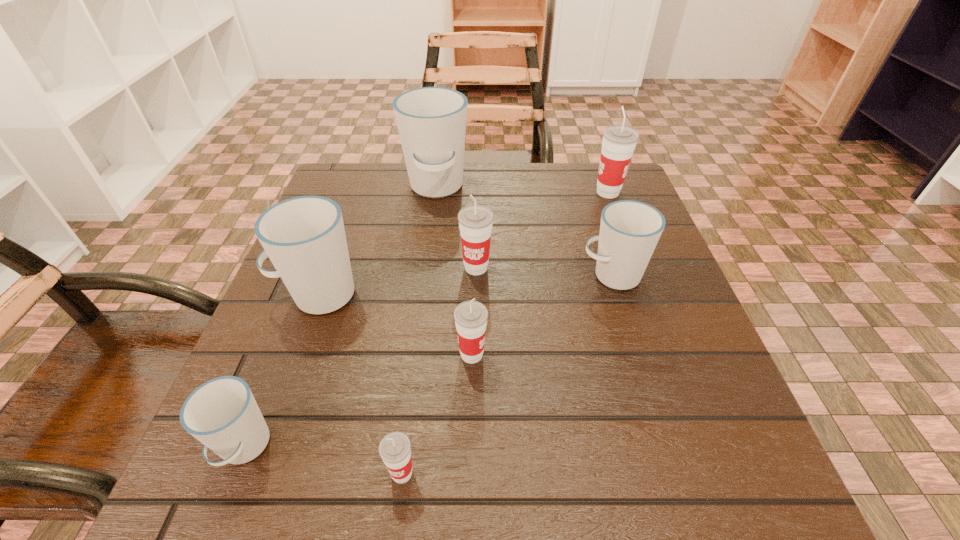
This screenshot has width=960, height=540. I want to click on white cup that is the second closest to the nearest red cup, so click(x=304, y=237).

The width and height of the screenshot is (960, 540). Identify the location of white cup that stands as the third closest to the third nearest red cup. (304, 237).

Identify the location of red cup that is the second closest to the rightmost white cup. [x=619, y=141].

Where is `red cup that is the closest to the second biggest red cup`? This screenshot has width=960, height=540. red cup that is the closest to the second biggest red cup is located at coordinates (471, 316).

Image resolution: width=960 pixels, height=540 pixels. I want to click on blank space that satisfies the following two spatial constraints: 1. on the side of the second biggest red cup with the logo; 2. with a handle on the side of the second biggest white cup, so click(476, 295).

Where is `vacant region that satisfies the following two spatial constraints: 1. with a handle on the side of the rightmost white cup; 2. with a handle on the side of the smallest white cup`? vacant region that satisfies the following two spatial constraints: 1. with a handle on the side of the rightmost white cup; 2. with a handle on the side of the smallest white cup is located at coordinates (665, 448).

I want to click on vacant area in the image that satisfies the following two spatial constraints: 1. on the side of the rightmost red cup with the logo; 2. on the side of the third nearest red cup with the logo, so click(x=636, y=268).

This screenshot has height=540, width=960. I want to click on vacant area in the image that satisfies the following two spatial constraints: 1. on the side of the third nearest cup with the logo; 2. on the side of the smallest red cup with the logo, so click(469, 474).

Find the location of a particular element. free space in the image that satisfies the following two spatial constraints: 1. on the side of the sixth farthest cup with the logo; 2. on the side of the smallest red cup with the logo is located at coordinates (469, 474).

At what (x,y) coordinates should I click in order to perform the action: click on free location that satisfies the following two spatial constraints: 1. with a handle on the side of the farthest white cup; 2. with a handle on the side of the second biggest white cup. Please return your answer as a coordinate pair (x, y). Image resolution: width=960 pixels, height=540 pixels. Looking at the image, I should click on (422, 295).